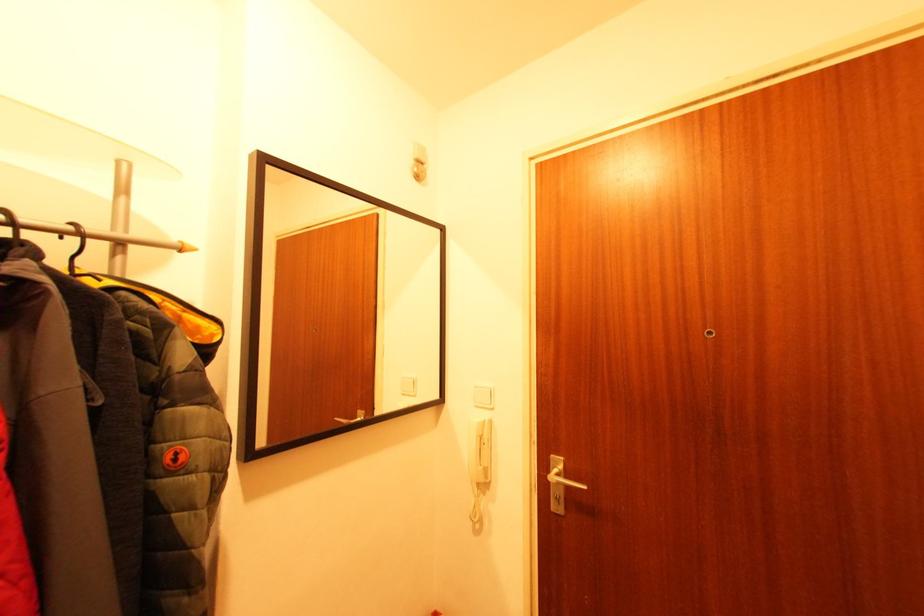
Where is `white intercom handset`? white intercom handset is located at coordinates (479, 450).